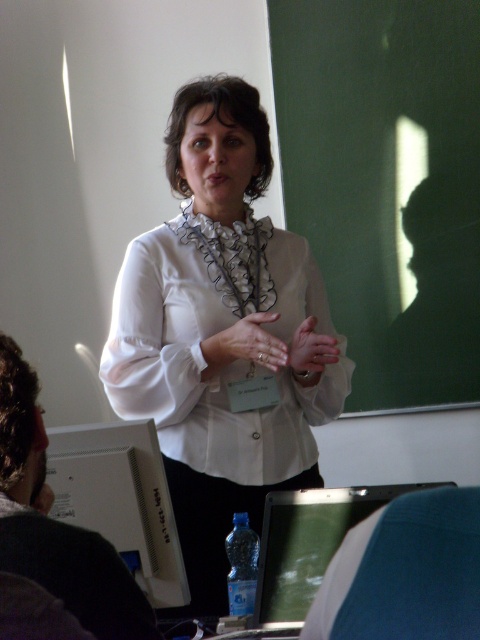
Question: Among these points, which one is nearest to the camera?

Choices:
 (A) (232, 589)
 (B) (374, 49)
 (C) (106, 436)

Answer: (C)

Question: Does white satin blouse at center appear on the left side of blue plastic bottle at center?

Choices:
 (A) no
 (B) yes

Answer: (B)

Question: Which is nearer to the white glossy monitor at lower left?

Choices:
 (A) green chalkboard at upper right
 (B) blue plastic bottle at center

Answer: (B)

Question: Is white satin blouse at center above blue plastic bottle at center?

Choices:
 (A) no
 (B) yes

Answer: (B)

Question: Is green chalkboard at upper right positioned before white glossy monitor at lower left?

Choices:
 (A) yes
 (B) no

Answer: (B)

Question: Among these points, which one is farthest from the camera?

Choices:
 (A) coord(286,340)
 (B) coord(383,125)
 (C) coord(116,486)
 (D) coord(242,609)

Answer: (B)